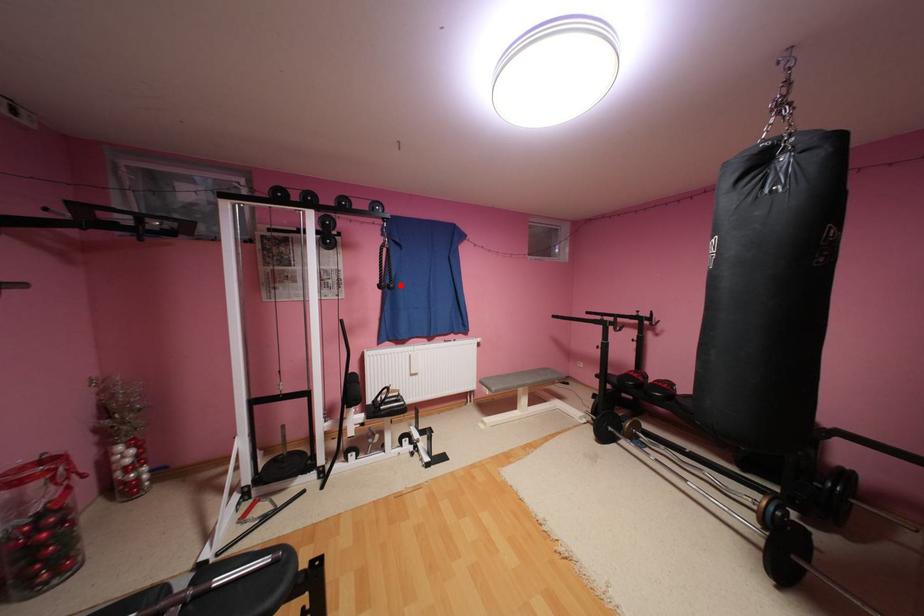
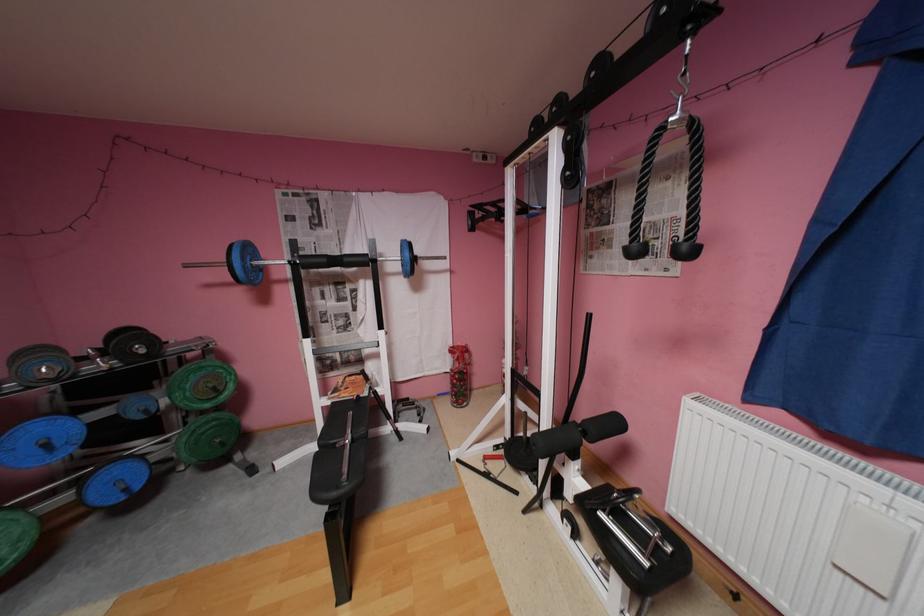
Where in the second image is the point corresponding to the highlighted location from the first image?

(695, 246)